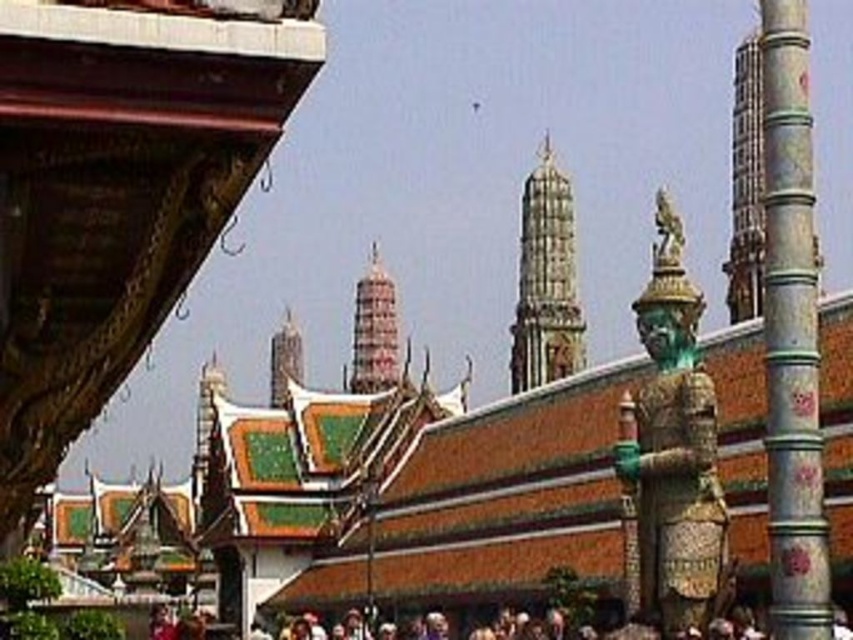
You are standing at the temple complex and want to take a photo of both the guardian statue and the temple building. The guardian statue is located at point (778, 205) and the temple building is at point (283, 332). According to the coordinates, which one is closer to you?

Point (778, 205) is in front of point (283, 332), so the guardian statue at point (778, 205) is closer to you.

You are standing in front of the temple complex and want to determine the relative positions of two points marked in the scene. Which point is closer to you, point (807,164) or point (546,236)?

Point (807,164) is closer to the viewer than point (546,236).

You are a tourist standing in front of the temple complex. You notice the silver metallic column at right and the green glazed tile temple at center. Which object is positioned higher from the ground?

The silver metallic column at right is above the green glazed tile temple at center, so it is positioned higher from the ground.